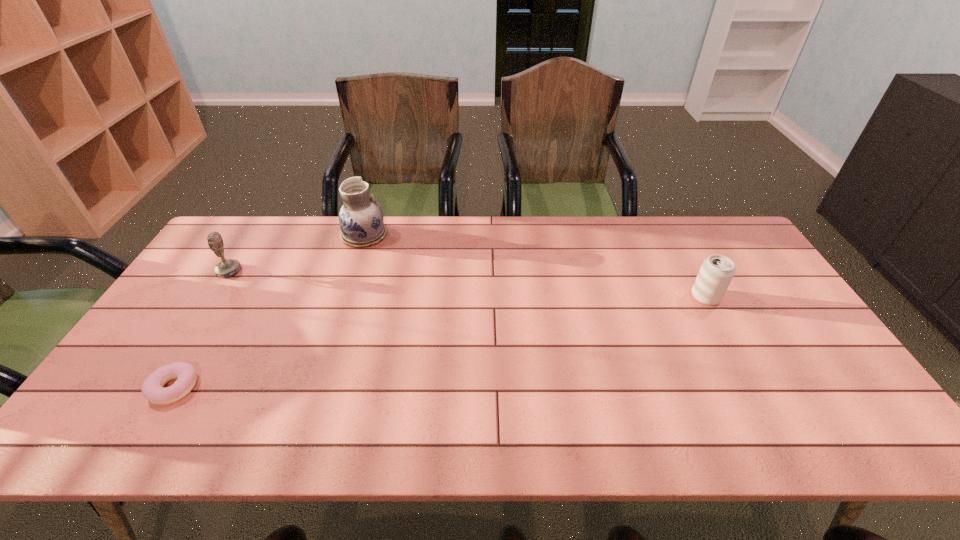
Image resolution: width=960 pixels, height=540 pixels. What are the coordinates of `free area in between the third farthest object and the doughnut` in the screenshot? It's located at (440, 342).

This screenshot has width=960, height=540. I want to click on empty space that is in between the pottery and the rightmost object, so click(535, 266).

Image resolution: width=960 pixels, height=540 pixels. What are the coordinates of `free point between the second farthest object and the tallest object` in the screenshot? It's located at (297, 253).

Where is `blank region between the second nearest object and the doughnut`? Image resolution: width=960 pixels, height=540 pixels. blank region between the second nearest object and the doughnut is located at coordinates (440, 342).

At what (x,y) coordinates should I click in order to perform the action: click on unoccupied position between the nearest object and the second farthest object. Please return your answer as a coordinate pair (x, y). Looking at the image, I should click on (202, 329).

Locate an element on the screen. This screenshot has width=960, height=540. vacant point located between the tallest object and the microphone is located at coordinates (297, 253).

You are a GUI agent. You are given a task and a screenshot of the screen. Output one action in this format:
    pyautogui.click(x=<x>, y=<y>)
    Task: Click on the free space between the second farthest object and the second nearest object
    
    Given the screenshot: What is the action you would take?
    pyautogui.click(x=468, y=284)

The image size is (960, 540). Identify the location of free space that is in between the doughnut and the microphone. (202, 329).

I want to click on vacant point located between the can and the pottery, so click(535, 266).

You are a GUI agent. You are given a task and a screenshot of the screen. Output one action in this format:
    pyautogui.click(x=<x>, y=<y>)
    Task: Click on the free spot between the nearest object and the can
    This screenshot has width=960, height=540.
    Given the screenshot: What is the action you would take?
    pyautogui.click(x=440, y=342)